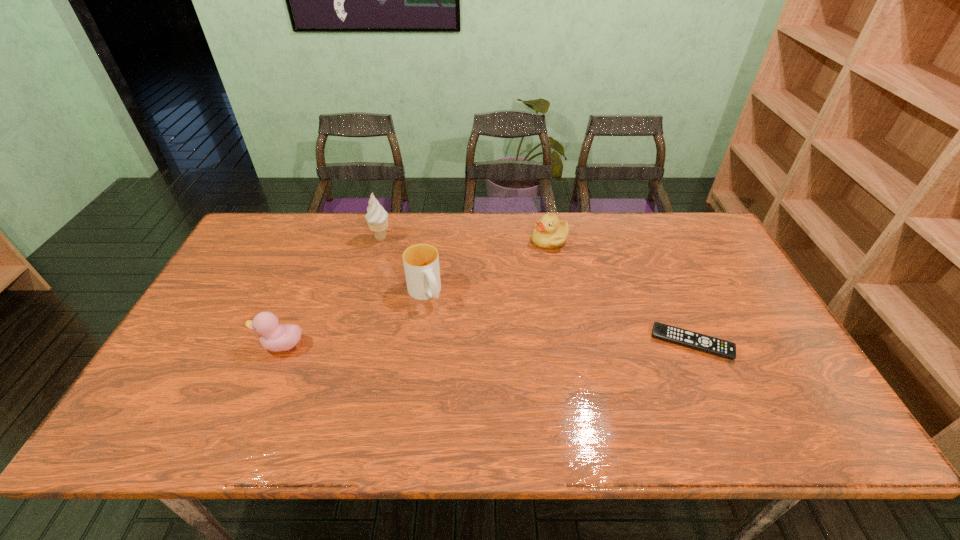
Locate an element on the screen. Image resolution: width=960 pixels, height=540 pixels. the leftmost object is located at coordinates (275, 337).

The image size is (960, 540). I want to click on the left duckling, so click(x=275, y=337).

Image resolution: width=960 pixels, height=540 pixels. I want to click on the rightmost object, so click(x=679, y=336).

Where is `remote control`? The height and width of the screenshot is (540, 960). remote control is located at coordinates (679, 336).

Identify the location of the tallest object. (377, 218).

Image resolution: width=960 pixels, height=540 pixels. I want to click on icecream, so click(377, 218).

Identify the location of the third nearest object. This screenshot has width=960, height=540. (421, 261).

Where is `cup`? cup is located at coordinates (421, 261).

The height and width of the screenshot is (540, 960). Find the location of `the right duckling`. the right duckling is located at coordinates (549, 233).

Locate an element on the screen. the farther duckling is located at coordinates (549, 233).